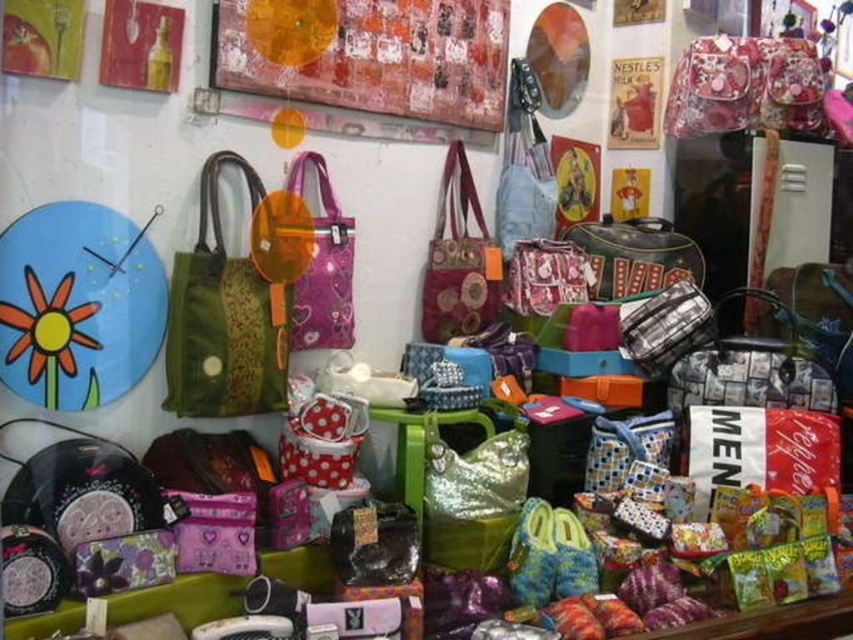
You are a customer in the store and want to place a small gift card between the textured canvas painting at upper center and the shiny metallic bag at center. The gift card is 30 inches long. Will it fit between them?

The distance between the textured canvas painting at upper center and the shiny metallic bag at center is 26.28 inches. Since the gift card is 30 inches long, it is longer than the available space. Therefore, the gift card will not fit between them.

You are a customer in the store and want to place a small accessory between the shiny gold handbag at center and the shiny metallic bag at center. The accessory is 15 inches long. Is there enough space between them to fit it?

The shiny gold handbag at center is 31.86 inches from the shiny metallic bag at center. Since the accessory is 15 inches long, which is less than the distance between them, there is enough space to fit it between the two bags.